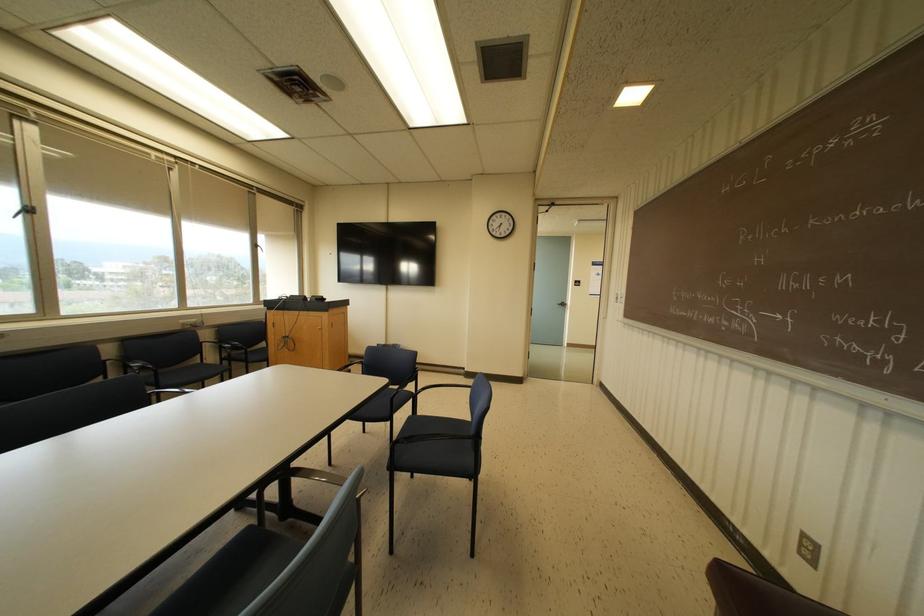
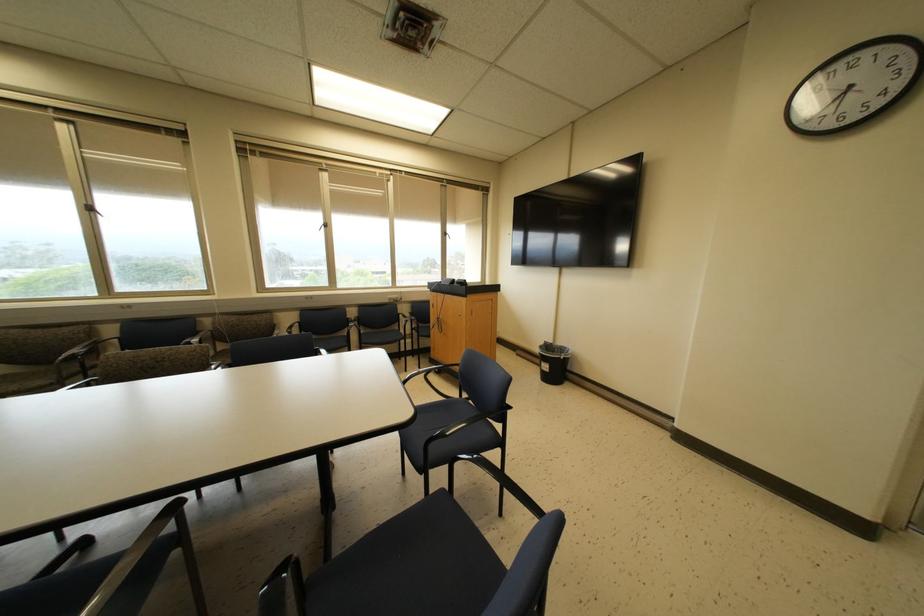
Where in the second image is the point corresponding to the point at 408,416 from the first image?

(442, 488)